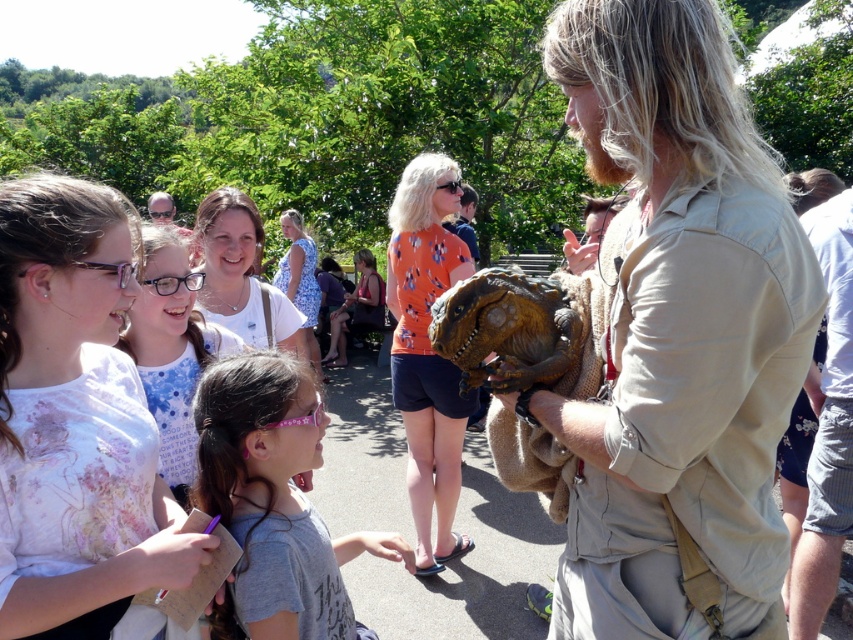
You are a photographer at the event and want to capture a photo of the gray fabric shirt at center and orange fabric dinosaur head at center. Which object should you focus on first if you want to ensure both are in focus without adjusting the camera settings?

The gray fabric shirt at center is shorter than the orange fabric dinosaur head at center, so you should focus on the orange fabric dinosaur head at center first to ensure both are in focus since it is farther away.